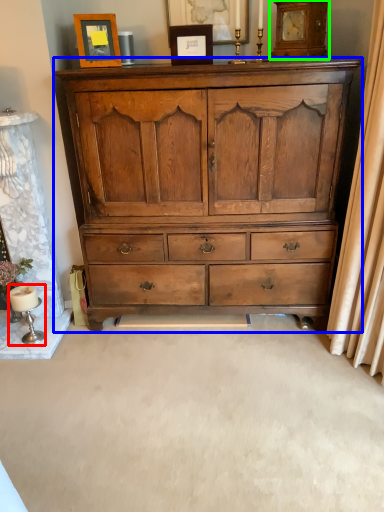
Question: Estimate the real-world distances between objects in this image. Which object is closer to table lamp (highlighted by a red box), chest of drawers (highlighted by a blue box) or clock (highlighted by a green box)?

Choices:
 (A) chest of drawers
 (B) clock

Answer: (A)